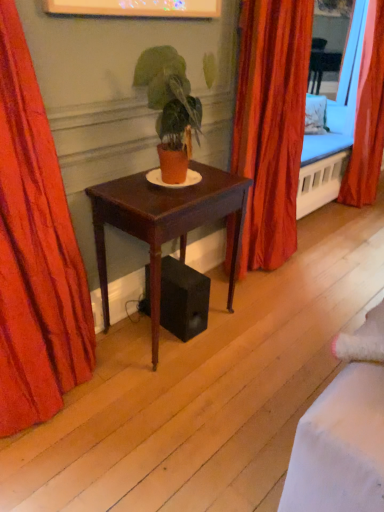
Identify the location of unoccupied region to the right of velvet red curtain at left, placed as the 3th curtain when sorted from right to left. (133, 403).